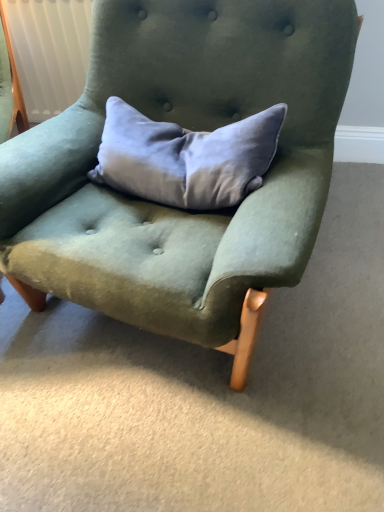
Question: Is satin gray pillow at center facing away from velvet green armchair at center?

Choices:
 (A) yes
 (B) no

Answer: (A)

Question: From a real-world perspective, is satin gray pillow at center on top of velvet green armchair at center?

Choices:
 (A) yes
 (B) no

Answer: (A)

Question: Is satin gray pillow at center closer to the viewer compared to velvet green armchair at center?

Choices:
 (A) yes
 (B) no

Answer: (B)

Question: Would you say satin gray pillow at center is outside velvet green armchair at center?

Choices:
 (A) no
 (B) yes

Answer: (A)

Question: Is satin gray pillow at center to the left of velvet green armchair at center from the viewer's perspective?

Choices:
 (A) no
 (B) yes

Answer: (A)

Question: From the image's perspective, is satin gray pillow at center located above velvet green armchair at center?

Choices:
 (A) no
 (B) yes

Answer: (B)

Question: Considering the relative positions of velvet green armchair at center and satin gray pillow at center in the image provided, is velvet green armchair at center to the right of satin gray pillow at center from the viewer's perspective?

Choices:
 (A) no
 (B) yes

Answer: (A)

Question: Does velvet green armchair at center have a greater height compared to satin gray pillow at center?

Choices:
 (A) no
 (B) yes

Answer: (B)

Question: Is velvet green armchair at center further to camera compared to satin gray pillow at center?

Choices:
 (A) yes
 (B) no

Answer: (B)

Question: Does velvet green armchair at center have a larger size compared to satin gray pillow at center?

Choices:
 (A) no
 (B) yes

Answer: (B)

Question: Would you say velvet green armchair at center is a long distance from satin gray pillow at center?

Choices:
 (A) yes
 (B) no

Answer: (B)

Question: Is velvet green armchair at center turned away from satin gray pillow at center?

Choices:
 (A) yes
 (B) no

Answer: (A)

Question: Based on their sizes in the image, would you say satin gray pillow at center is bigger or smaller than velvet green armchair at center?

Choices:
 (A) small
 (B) big

Answer: (A)